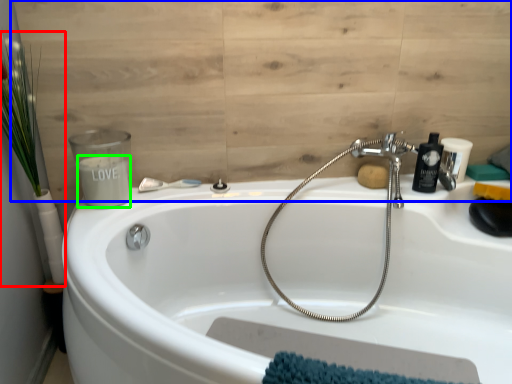
Question: Which object is positioned closest to plant (highlighted by a red box)? Select from plywood (highlighted by a blue box) and liquid (highlighted by a green box).

Choices:
 (A) plywood
 (B) liquid

Answer: (B)